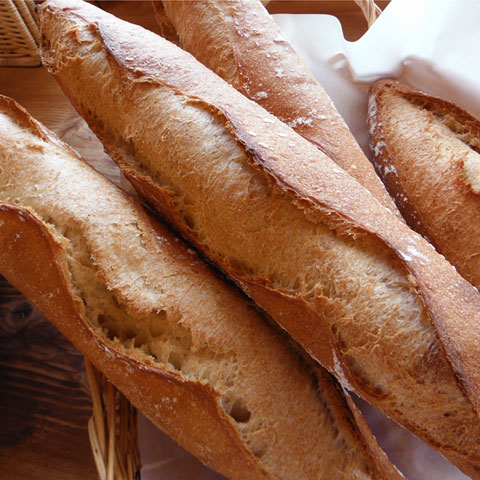
Locate an element on the screen. The height and width of the screenshot is (480, 480). wicker basket is located at coordinates point(21,43).